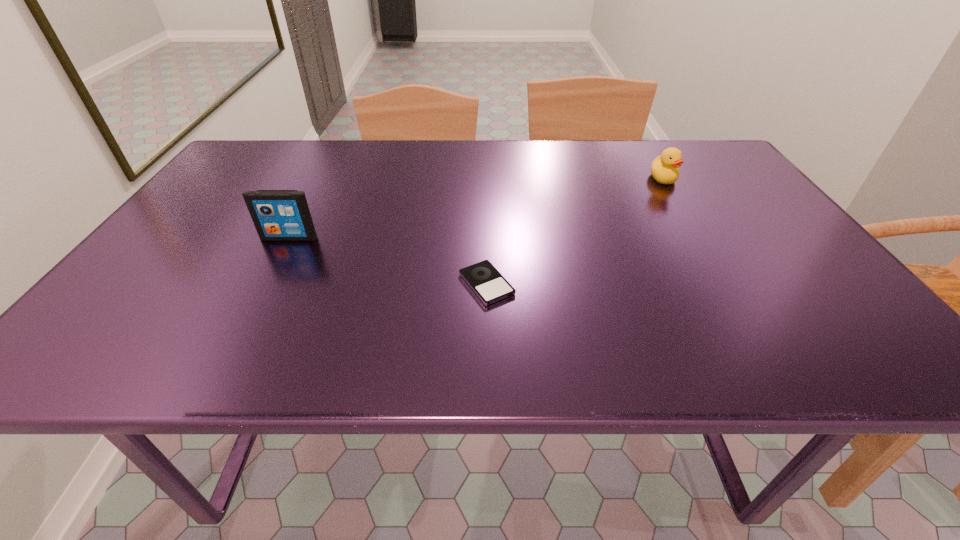
Where is `free space that satisfies the following two spatial constraints: 1. on the front screen of the second object from right to left; 2. on the left side of the leftmost object`? This screenshot has height=540, width=960. free space that satisfies the following two spatial constraints: 1. on the front screen of the second object from right to left; 2. on the left side of the leftmost object is located at coordinates (265, 284).

This screenshot has height=540, width=960. Find the location of `free space that satisfies the following two spatial constraints: 1. on the front screen of the second object from right to left; 2. on the right side of the farther iPod`. free space that satisfies the following two spatial constraints: 1. on the front screen of the second object from right to left; 2. on the right side of the farther iPod is located at coordinates (265, 284).